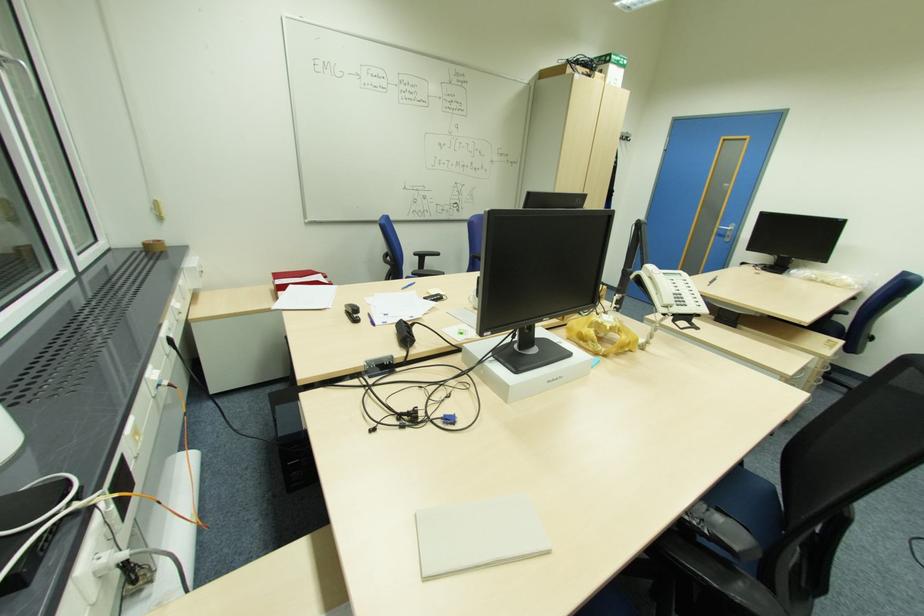
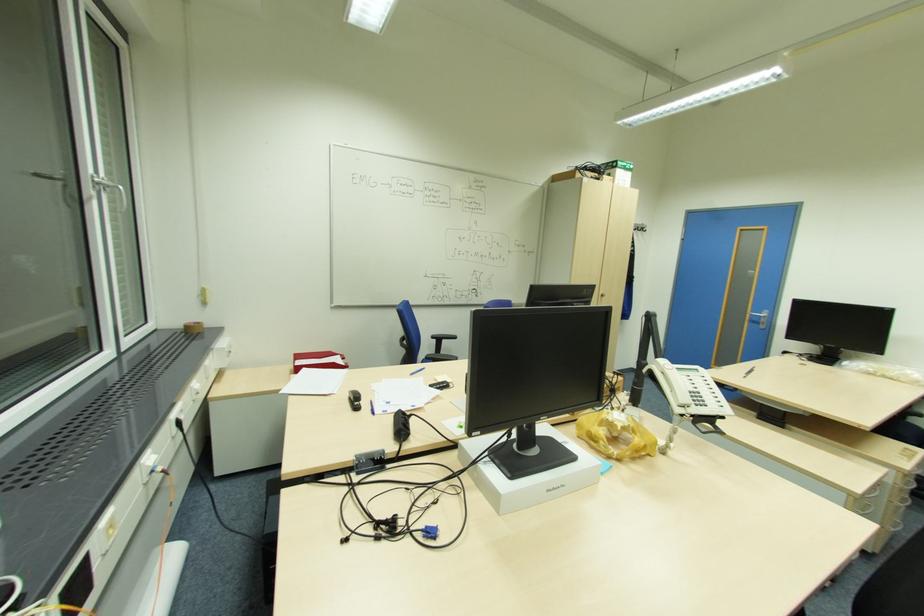
Where in the second image is the point corresponding to point (681, 305) from the first image?

(699, 403)